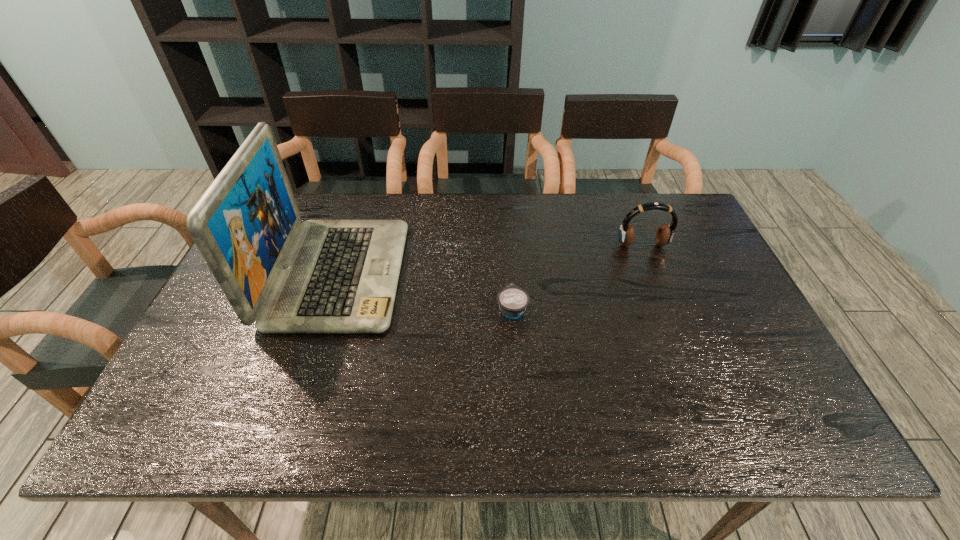
Identify the location of free point between the headset and the leftmost object. Image resolution: width=960 pixels, height=540 pixels. (490, 260).

Locate an element on the screen. vacant space that is in between the shortest object and the rightmost object is located at coordinates (577, 277).

Image resolution: width=960 pixels, height=540 pixels. What are the coordinates of `vacant space in between the second object from right to left and the rightmost object` in the screenshot? It's located at (577, 277).

At what (x,y) coordinates should I click in order to perform the action: click on vacant area between the headset and the tallest object. Please return your answer as a coordinate pair (x, y). This screenshot has height=540, width=960. Looking at the image, I should click on (490, 260).

Locate an element on the screen. The image size is (960, 540). vacant area between the second tallest object and the yogurt is located at coordinates (577, 277).

This screenshot has width=960, height=540. In order to click on vacant area that lies between the second object from right to left and the leftmost object in this screenshot , I will do `click(425, 291)`.

Image resolution: width=960 pixels, height=540 pixels. In order to click on unoccupied position between the leftmost object and the second object from left to right in this screenshot , I will do 425,291.

Image resolution: width=960 pixels, height=540 pixels. I want to click on unoccupied area between the laptop computer and the shortest object, so point(425,291).

The width and height of the screenshot is (960, 540). Identify the location of free space between the tallest object and the second shortest object. (490, 260).

Locate an element on the screen. the second closest object to the laptop computer is located at coordinates (664, 235).